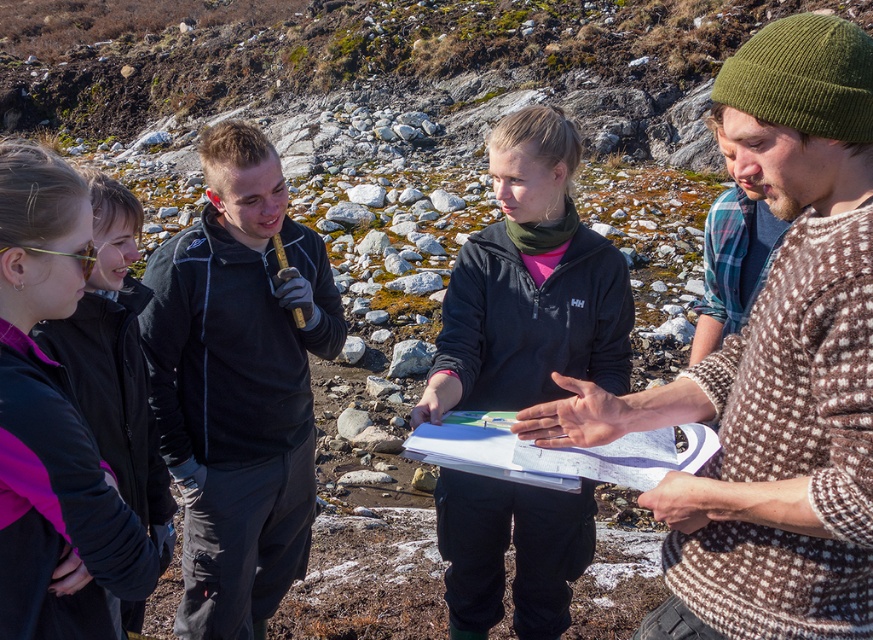
You are standing at the center of the rocky terrain and want to locate the brown knitted hat at upper right. According to the coordinates provided, in which direction should you look to find it?

The brown knitted hat at upper right is located at coordinates 0.577 on the x axis and 0.887 on the y axis. Since the y coordinate is higher than the x coordinate, it is positioned more towards the upper part of the image. Therefore, you should look upwards and slightly to the right to locate it.

Where is the black fleece jacket at center located in the image?

The black fleece jacket at center is located at point 0.602 on the x axis and 0.274 on the y axis.